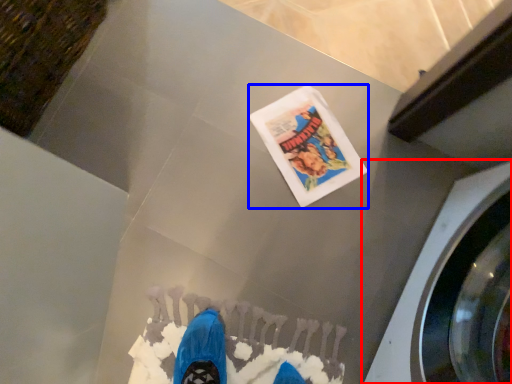
Question: Which object is further to the camera taking this photo, washing machine (highlighted by a red box) or flyer (highlighted by a blue box)?

Choices:
 (A) washing machine
 (B) flyer

Answer: (B)